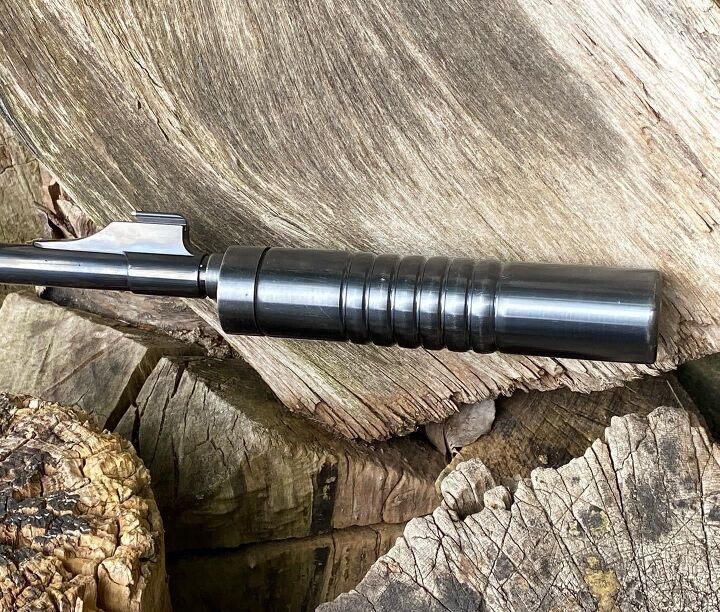
Identify the location of lower left wood and lower right wood have burn marks. (32, 510), (636, 517).